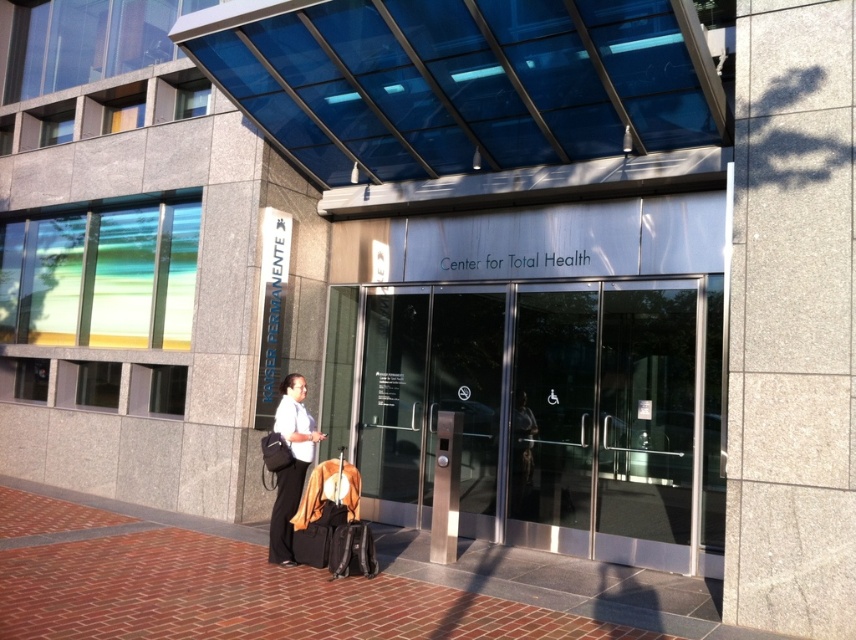
Question: Does clear glass doors at center appear on the left side of black fabric suitcase at center?

Choices:
 (A) yes
 (B) no

Answer: (B)

Question: Among these points, which one is nearest to the camera?

Choices:
 (A) (296, 490)
 (B) (330, 464)
 (C) (339, 548)

Answer: (C)

Question: Can you confirm if matte black backpack at lower left is positioned above black fabric suitcase at center?

Choices:
 (A) no
 (B) yes

Answer: (B)

Question: Which is nearer to the black fabric suitcase at center?

Choices:
 (A) matte black backpack at lower left
 (B) clear glass doors at center
 (C) brown fabric suitcase at center

Answer: (C)

Question: Is brick pavement at lower left positioned behind brown fabric suitcase at center?

Choices:
 (A) yes
 (B) no

Answer: (A)

Question: Based on their relative distances, which object is farther from the brick pavement at lower left?

Choices:
 (A) brown fabric suitcase at center
 (B) clear glass doors at center

Answer: (A)